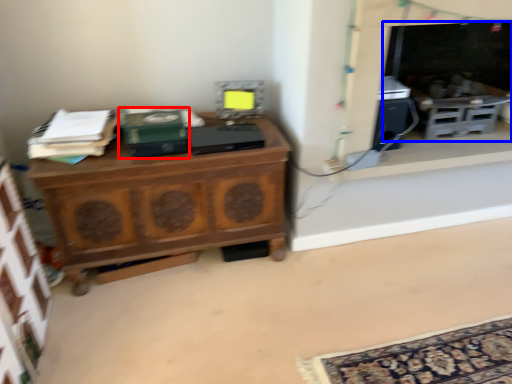
Question: Which object appears closest to the camera in this image, book (highlighted by a red box) or fireplace (highlighted by a blue box)?

Choices:
 (A) book
 (B) fireplace

Answer: (A)